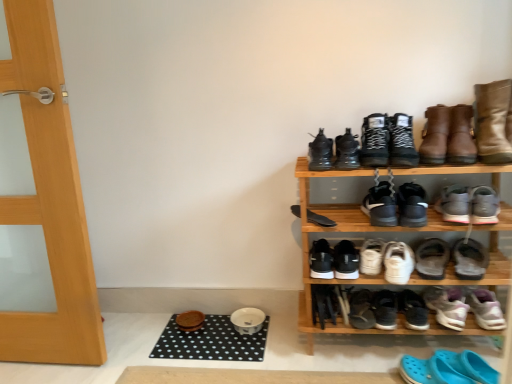
Locate an element on the screen. vacant area that is situated to the right of wooden door at left is located at coordinates (136, 343).